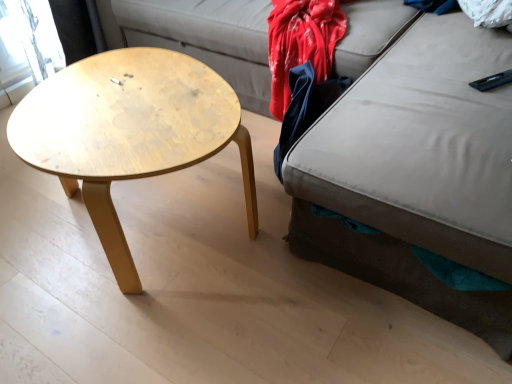
Question: Is dark blue fabric at right inside or outside of natural wood coffee table at left?

Choices:
 (A) outside
 (B) inside

Answer: (A)

Question: Relative to natural wood coffee table at left, is dark blue fabric at right in front or behind?

Choices:
 (A) behind
 (B) front

Answer: (A)

Question: In terms of width, does dark blue fabric at right look wider or thinner when compared to natural wood coffee table at left?

Choices:
 (A) thin
 (B) wide

Answer: (A)

Question: In terms of width, does natural wood coffee table at left look wider or thinner when compared to dark blue fabric at right?

Choices:
 (A) thin
 (B) wide

Answer: (B)

Question: Is natural wood coffee table at left bigger or smaller than dark blue fabric at right?

Choices:
 (A) big
 (B) small

Answer: (A)

Question: In the image, is natural wood coffee table at left on the left side or the right side of dark blue fabric at right?

Choices:
 (A) right
 (B) left

Answer: (B)

Question: Is point (97, 115) positioned closer to the camera than point (282, 148)?

Choices:
 (A) closer
 (B) farther

Answer: (A)